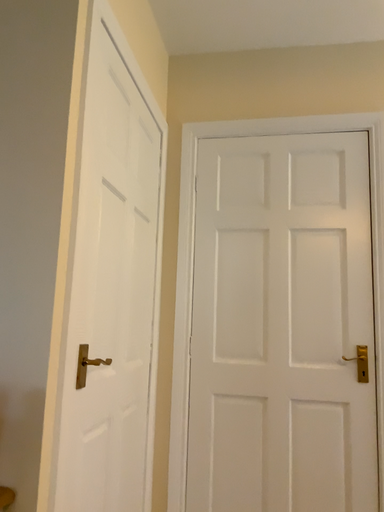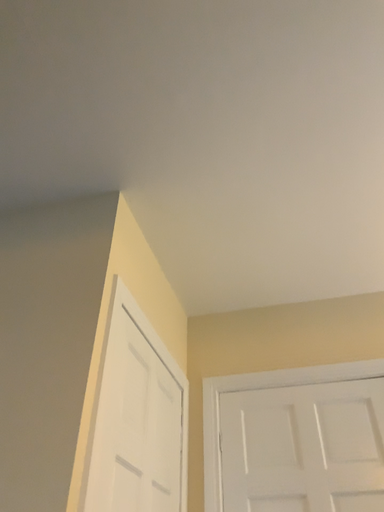
Question: How did the camera likely rotate when shooting the video?

Choices:
 (A) rotated upward
 (B) rotated downward

Answer: (A)